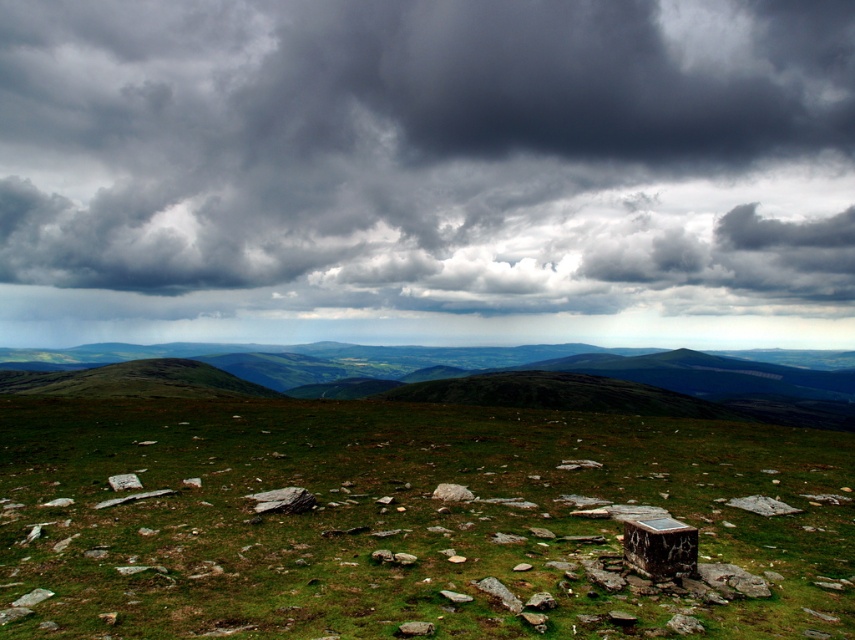
Question: Which point is farther from the camera taking this photo?

Choices:
 (A) (1, 83)
 (B) (499, 595)

Answer: (A)

Question: Does gray stone at lower right appear under gray rock at center?

Choices:
 (A) no
 (B) yes

Answer: (B)

Question: Considering the relative positions of gray stone at lower right and gray rock at lower center in the image provided, where is gray stone at lower right located with respect to gray rock at lower center?

Choices:
 (A) left
 (B) right

Answer: (B)

Question: Which object is positioned closest to the gray rock at center?

Choices:
 (A) gray rough stone at lower left
 (B) dark gray cloud at upper center
 (C) gray stone at lower right
 (D) gray rock at lower center

Answer: (D)

Question: Does green grassy field at center have a smaller size compared to gray rock at center?

Choices:
 (A) yes
 (B) no

Answer: (B)

Question: Based on their relative distances, which object is farther from the green grassy field at center?

Choices:
 (A) dark gray cloud at upper center
 (B) gray rock at center
 (C) gray stone at lower right

Answer: (A)